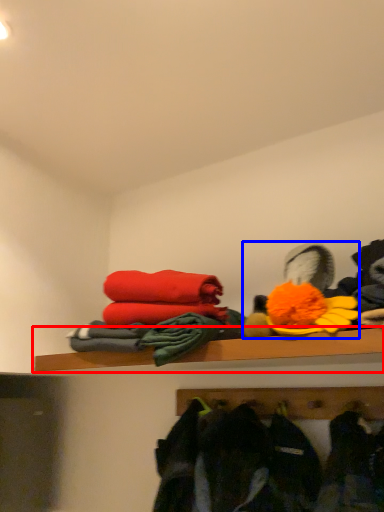
Question: Which point is further to the camera, shelf (highlighted by a red box) or toy (highlighted by a blue box)?

Choices:
 (A) shelf
 (B) toy

Answer: (B)